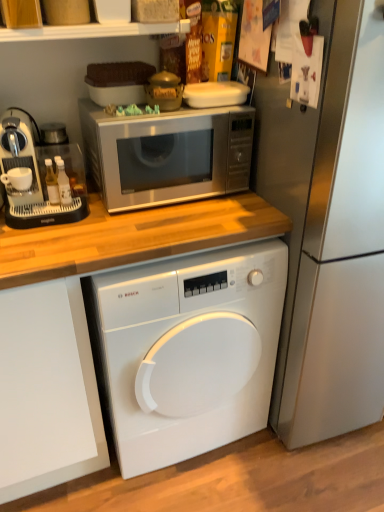
What do you see at coordinates (92, 31) in the screenshot? Image resolution: width=384 pixels, height=512 pixels. I see `white glossy shelf at upper center` at bounding box center [92, 31].

The height and width of the screenshot is (512, 384). Identify the location of satin silver refrigerator at right. (330, 230).

The height and width of the screenshot is (512, 384). Describe the element at coordinates (167, 154) in the screenshot. I see `satin silver microwave at upper center` at that location.

This screenshot has height=512, width=384. Identify the location of white matte plastic container at upper center. (215, 94).

Which of these two, satin silver microwave at upper center or satin silver refrigerator at right, is bigger?

satin silver refrigerator at right.

Is satin silver microwave at upper center completely or partially outside of satin silver refrigerator at right?

That's correct, satin silver microwave at upper center is outside of satin silver refrigerator at right.

What's the angular difference between satin silver microwave at upper center and satin silver refrigerator at right's facing directions?

The angular difference between satin silver microwave at upper center and satin silver refrigerator at right is 0.0398 degrees.

Who is taller, satin silver microwave at upper center or satin silver refrigerator at right?

satin silver refrigerator at right is taller.

Which object is positioned more to the right, white plastic coffee machine at left or white matte plastic container at upper center?

From the viewer's perspective, white matte plastic container at upper center appears more on the right side.

Is white plastic coffee machine at left far from white matte plastic container at upper center?

No, white plastic coffee machine at left is in close proximity to white matte plastic container at upper center.

How much distance is there between white plastic coffee machine at left and white matte plastic container at upper center?

19.96 inches.

Considering the positions of objects white plastic coffee machine at left and white matte plastic container at upper center in the image provided, who is behind, white plastic coffee machine at left or white matte plastic container at upper center?

Positioned behind is white matte plastic container at upper center.

Is white plastic coffee machine at left oriented away from satin silver microwave at upper center?

No, satin silver microwave at upper center is not at the back of white plastic coffee machine at left.

Which is more distant, (27, 138) or (213, 121)?

Point (213, 121)

Does white plastic coffee machine at left contain satin silver microwave at upper center?

No.

Is satin silver refrigerator at right in front of or behind white glossy washing machine at center in the image?

satin silver refrigerator at right is in front of white glossy washing machine at center.

Does point (380, 55) appear closer or farther from the camera than point (88, 289)?

Point (380, 55).

Which of these two, satin silver refrigerator at right or white glossy washing machine at center, stands taller?

satin silver refrigerator at right.

Would you say satin silver refrigerator at right is a long distance from white glossy washing machine at center?

No, satin silver refrigerator at right is not far from white glossy washing machine at center.

Does point (227, 93) come in front of point (246, 258)?

No, (227, 93) is further to viewer.

Who is bigger, white matte plastic container at upper center or white glossy washing machine at center?

With larger size is white glossy washing machine at center.

Is white glossy washing machine at center at the back of white matte plastic container at upper center?

No.

Between white glossy shelf at upper center and white glossy washing machine at center, which one has smaller size?

white glossy shelf at upper center.

In the image, is white glossy shelf at upper center on the left side or the right side of white glossy washing machine at center?

From the image, it's evident that white glossy shelf at upper center is to the left of white glossy washing machine at center.

Is point (83, 33) closer or farther from the camera than point (181, 287)?

Point (83, 33) is positioned closer to the camera compared to point (181, 287).

In the scene shown: Is satin silver refrigerator at right located within white matte plastic container at upper center?

No.

Are white matte plastic container at upper center and satin silver refrigerator at right far apart?

No.

Is white matte plastic container at upper center facing away from satin silver refrigerator at right?

white matte plastic container at upper center is not turned away from satin silver refrigerator at right.

Considering the positions of objects white matte plastic container at upper center and satin silver refrigerator at right in the image provided, who is more to the right, white matte plastic container at upper center or satin silver refrigerator at right?

satin silver refrigerator at right.

Identify the location of refrigerator that is on the right side of satin silver microwave at upper center. Image resolution: width=384 pixels, height=512 pixels. (330, 230).

In the image, there is a white plastic coffee machine at left. Where is `appliance above it (from the image's perspective)`? This screenshot has width=384, height=512. appliance above it (from the image's perspective) is located at coordinates (215, 94).

Based on their spatial positions, is white glossy washing machine at center or white matte plastic container at upper center closer to white glossy shelf at upper center?

white matte plastic container at upper center is closer to white glossy shelf at upper center.

Looking at the image, which one is located closer to white glossy washing machine at center, white glossy shelf at upper center or satin silver microwave at upper center?

Based on the image, satin silver microwave at upper center appears to be nearer to white glossy washing machine at center.

Which object lies nearer to the anchor point white glossy washing machine at center, white glossy shelf at upper center or satin silver refrigerator at right?

satin silver refrigerator at right is positioned closer to the anchor white glossy washing machine at center.

Estimate the real-world distances between objects in this image. Which object is further from satin silver refrigerator at right, white glossy washing machine at center or white plastic coffee machine at left?

Among the two, white plastic coffee machine at left is located further to satin silver refrigerator at right.

Which object lies further to the anchor point white plastic coffee machine at left, white matte plastic container at upper center or white glossy washing machine at center?

white glossy washing machine at center lies further to white plastic coffee machine at left than the other object.

Which object lies further to the anchor point satin silver refrigerator at right, white matte plastic container at upper center or white plastic coffee machine at left?

white plastic coffee machine at left is positioned further to the anchor satin silver refrigerator at right.

Which object lies nearer to the anchor point satin silver refrigerator at right, white matte plastic container at upper center or satin silver microwave at upper center?

Based on the image, satin silver microwave at upper center appears to be nearer to satin silver refrigerator at right.

Which object lies further to the anchor point satin silver microwave at upper center, white glossy shelf at upper center or white matte plastic container at upper center?

The object further to satin silver microwave at upper center is white glossy shelf at upper center.

Find the location of a particular element. The height and width of the screenshot is (512, 384). microwave oven between white glossy shelf at upper center and satin silver refrigerator at right in the horizontal direction is located at coordinates (167, 154).

Locate an element on the screen. washing machine located between white plastic coffee machine at left and satin silver refrigerator at right in the left-right direction is located at coordinates (187, 351).

Where is `appliance between white glossy washing machine at center and satin silver refrigerator at right`? appliance between white glossy washing machine at center and satin silver refrigerator at right is located at coordinates (215, 94).

You are a GUI agent. You are given a task and a screenshot of the screen. Output one action in this format:
    pyautogui.click(x=<x>, y=<y>)
    Task: Click on the appliance situated between white glossy shelf at upper center and satin silver refrigerator at right from left to right
    The image size is (384, 512).
    Given the screenshot: What is the action you would take?
    pyautogui.click(x=215, y=94)